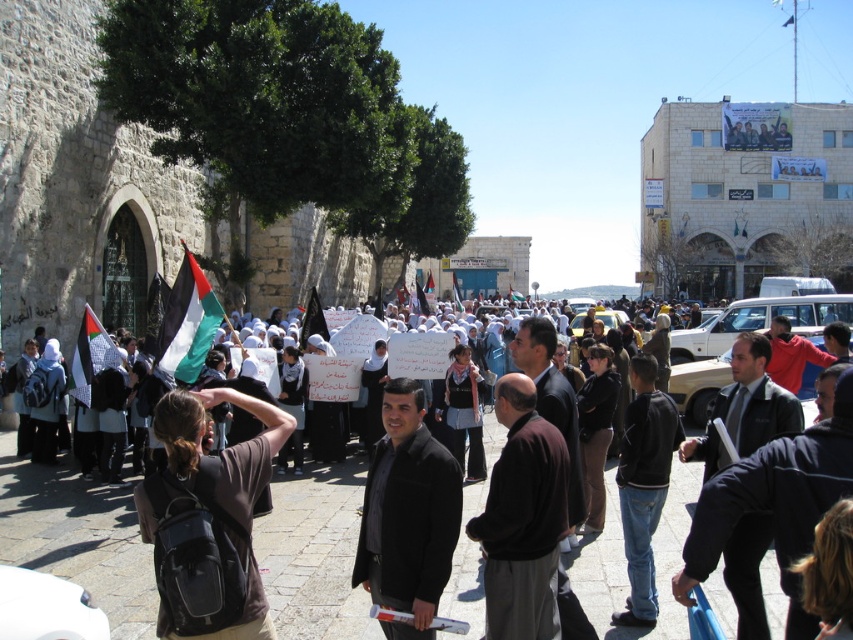
You are standing at the arched doorway on the left side of the image. You want to walk towards the crowd in the center and right. There are two points you can choose to walk through, point A at coordinates point (775,548) and point B at coordinates point (202,356). Which point is closer to you?

Point A at coordinates point (775,548) is in front of point B at coordinates point (202,356), so point A is closer to you.

Based on the photo, you are a photographer standing at the edge of the crowd. You want to take a photo that includes both the black matte jacket at center and the black and white flag at center. Given that your camera has a maximum focus range of 15 meters, will you be able to capture both subjects clearly in the same frame?

The distance between the black matte jacket at center and the black and white flag at center is 15.40 meters. Since your camera can only focus up to 15 meters, you won not be able to capture both subjects clearly in the same frame.